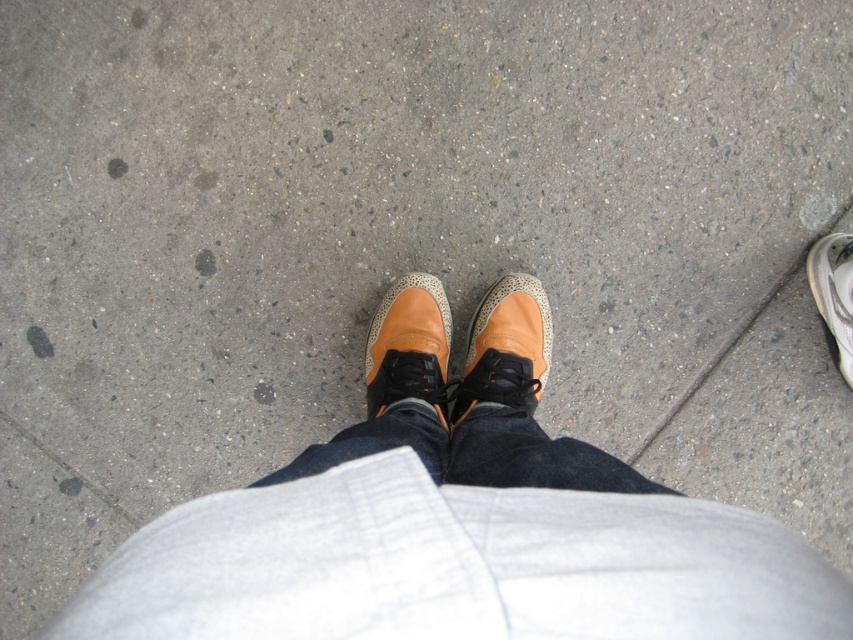
Who is positioned more to the right, tan suede sneaker at center or white textured sneaker at lower right?

white textured sneaker at lower right is more to the right.

Image resolution: width=853 pixels, height=640 pixels. In order to click on tan suede sneaker at center in this screenshot , I will do `click(409, 346)`.

Does tan textured sneaker at center have a greater height compared to tan suede sneaker at center?

Correct, tan textured sneaker at center is much taller as tan suede sneaker at center.

The height and width of the screenshot is (640, 853). Describe the element at coordinates (508, 348) in the screenshot. I see `tan textured sneaker at center` at that location.

Locate an element on the screen. The width and height of the screenshot is (853, 640). tan textured sneaker at center is located at coordinates (508, 348).

Which is below, tan textured sneaker at center or white textured sneaker at lower right?

tan textured sneaker at center

Which is behind, point (480, 396) or point (840, 326)?

The point (840, 326) is more distant.

The image size is (853, 640). Identify the location of tan textured sneaker at center. (508, 348).